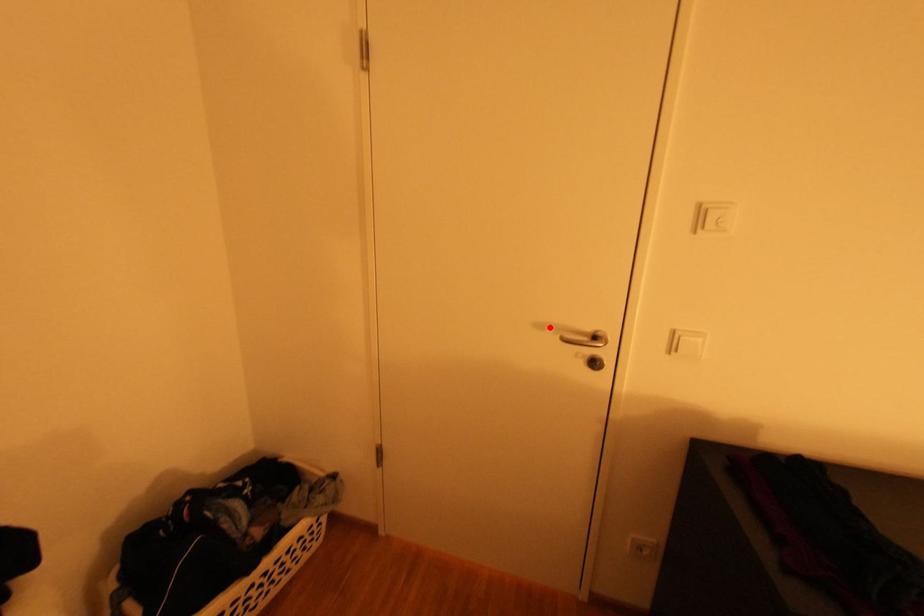
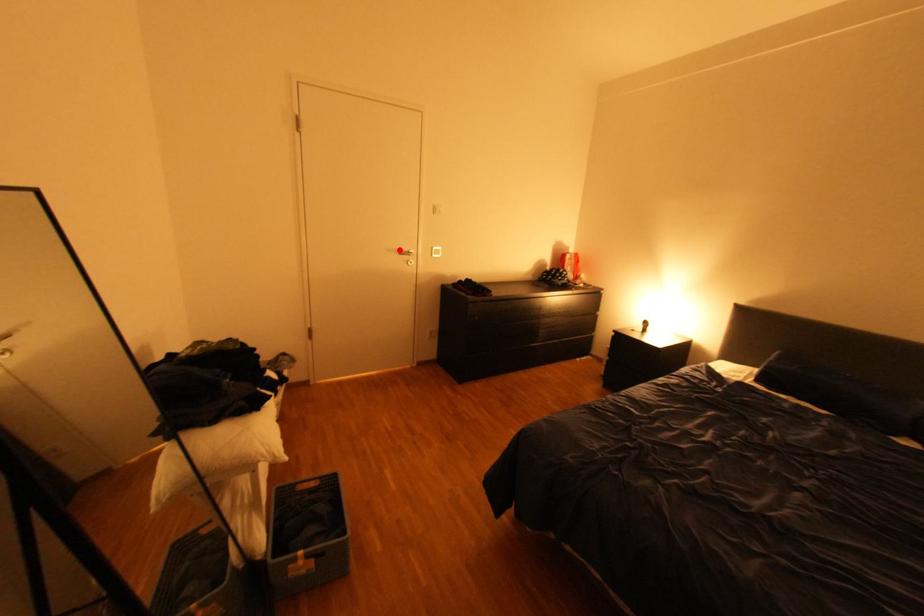
I am providing you with two images of the same scene from different viewpoints. A red point is marked on the first image and another point is marked on the second image. Is the red point in image1 aligned with the point shown in image2?

Yes